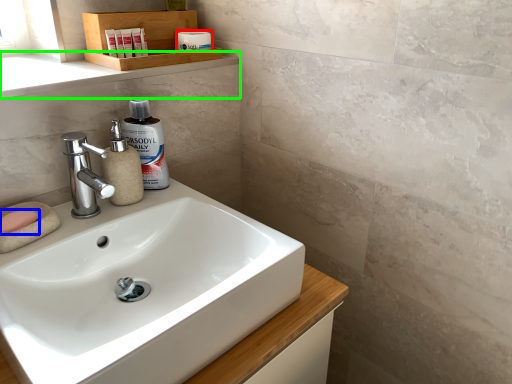
Question: Which object is positioned closest to toiletry (highlighted by a red box)? Select from soap (highlighted by a blue box) and window sill (highlighted by a green box).

Choices:
 (A) soap
 (B) window sill

Answer: (B)